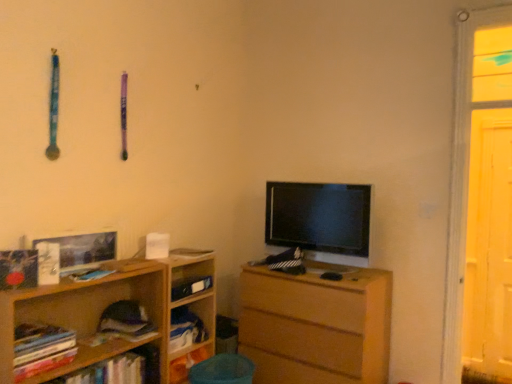
Question: Considering the relative positions of black glossy tv at center and hardcover book at center, which is counted as the third book, starting from the back, in the image provided, is black glossy tv at center behind hardcover book at center, which is counted as the third book, starting from the back,?

Choices:
 (A) no
 (B) yes

Answer: (B)

Question: Is black glossy tv at center aimed at hardcover book at center, the second book viewed from the front?

Choices:
 (A) no
 (B) yes

Answer: (B)

Question: Does black glossy tv at center have a greater width compared to hardcover book at center, the second book viewed from the front?

Choices:
 (A) yes
 (B) no

Answer: (B)

Question: From the image's perspective, does black glossy tv at center appear lower than hardcover book at center, the second book viewed from the front?

Choices:
 (A) no
 (B) yes

Answer: (A)

Question: Does black glossy tv at center have a greater height compared to hardcover book at center, which is counted as the third book, starting from the back?

Choices:
 (A) no
 (B) yes

Answer: (B)

Question: Considering the positions of hardcover book at center, marked as the 4th book in a front-to-back arrangement, and hardcover book at center, which is counted as the third book, starting from the back, in the image, is hardcover book at center, marked as the 4th book in a front-to-back arrangement, taller or shorter than hardcover book at center, which is counted as the third book, starting from the back,?

Choices:
 (A) short
 (B) tall

Answer: (B)

Question: Is hardcover book at center, placed as the 1th book when sorted from back to front, wider or thinner than hardcover book at center, the second book viewed from the front?

Choices:
 (A) wide
 (B) thin

Answer: (A)

Question: In the image, is hardcover book at center, marked as the 4th book in a front-to-back arrangement, on the left side or the right side of hardcover book at center, the second book viewed from the front?

Choices:
 (A) right
 (B) left

Answer: (A)

Question: From a real-world perspective, is hardcover book at center, marked as the 4th book in a front-to-back arrangement, positioned above or below hardcover book at center, which is counted as the third book, starting from the back?

Choices:
 (A) below
 (B) above

Answer: (A)

Question: Does point (182, 264) appear closer or farther from the camera than point (509, 302)?

Choices:
 (A) closer
 (B) farther

Answer: (A)

Question: From a real-world perspective, is wooden bookshelf at lower left, which ranks as the 1th shelf in back-to-front order, positioned above or below transparent plastic screen door at right?

Choices:
 (A) above
 (B) below

Answer: (B)

Question: Is wooden bookshelf at lower left, marked as the second shelf in a front-to-back arrangement, wider or thinner than transparent plastic screen door at right?

Choices:
 (A) thin
 (B) wide

Answer: (B)

Question: Is wooden bookshelf at lower left, which ranks as the 1th shelf in back-to-front order, taller or shorter than transparent plastic screen door at right?

Choices:
 (A) tall
 (B) short

Answer: (B)

Question: Is wooden bookshelf at left, the 1th shelf when ordered from front to back, bigger or smaller than soft purple fabric book at lower left, which ranks as the 3th book in front-to-back order?

Choices:
 (A) small
 (B) big

Answer: (B)

Question: Is point (10, 314) closer or farther from the camera than point (112, 336)?

Choices:
 (A) closer
 (B) farther

Answer: (A)